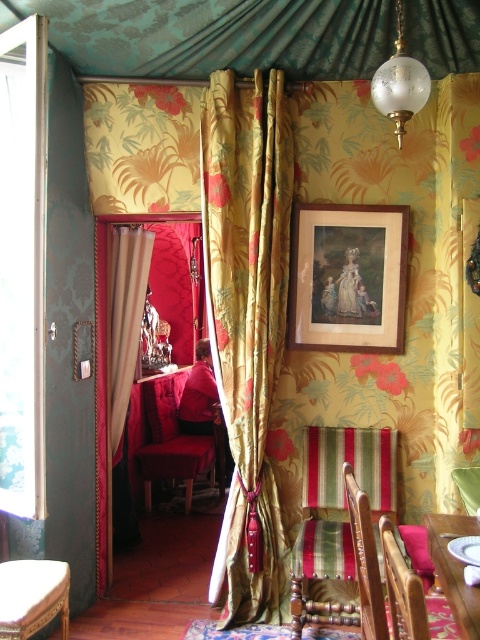
Question: Is velvet red armchair at center bigger than wooden polished table at lower right?

Choices:
 (A) no
 (B) yes

Answer: (B)

Question: Is teal damask fabric canopy at upper center thinner than striped fabric armchair at lower right?

Choices:
 (A) no
 (B) yes

Answer: (A)

Question: Which point appears farthest from the camera in this image?

Choices:
 (A) (387, 264)
 (B) (171, 476)
 (C) (17, 605)

Answer: (B)

Question: Considering the real-world distances, which object is closest to the gold floral fabric curtain at center?

Choices:
 (A) teal damask fabric canopy at upper center
 (B) wooden frame at upper center
 (C) beige fabric curtain at left

Answer: (B)

Question: From the image, what is the correct spatial relationship of wooden frame at upper center in relation to beige fabric curtain at left?

Choices:
 (A) left
 (B) right

Answer: (B)

Question: Considering the real-world distances, which object is closest to the gold floral fabric curtain at center?

Choices:
 (A) beige fabric curtain at left
 (B) wooden cushioned stool at lower left

Answer: (A)